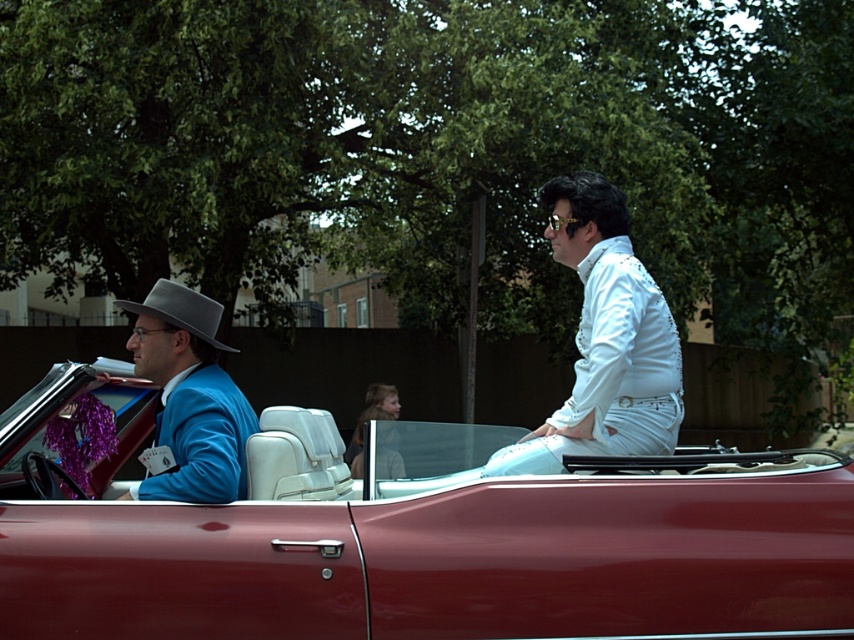
Question: Among these points, which one is farthest from the camera?

Choices:
 (A) (553, 595)
 (B) (208, 332)
 (C) (395, 410)
 (D) (566, 230)

Answer: (C)

Question: Which point appears farthest from the camera in this image?

Choices:
 (A) (205, 340)
 (B) (695, 632)

Answer: (A)

Question: Does shiny red car at center have a lesser width compared to gray felt fedora at left?

Choices:
 (A) yes
 (B) no

Answer: (B)

Question: Observing the image, what is the correct spatial positioning of blue velvet suit at left in reference to light brown hair at center?

Choices:
 (A) above
 (B) below

Answer: (A)

Question: Considering the real-world distances, which object is farthest from the light brown hair at center?

Choices:
 (A) gray felt fedora at left
 (B) white sequined jacket at right
 (C) shiny red car at center
 (D) blue velvet suit at left

Answer: (D)

Question: Is white sequined jacket at right above gray felt fedora at left?

Choices:
 (A) no
 (B) yes

Answer: (A)